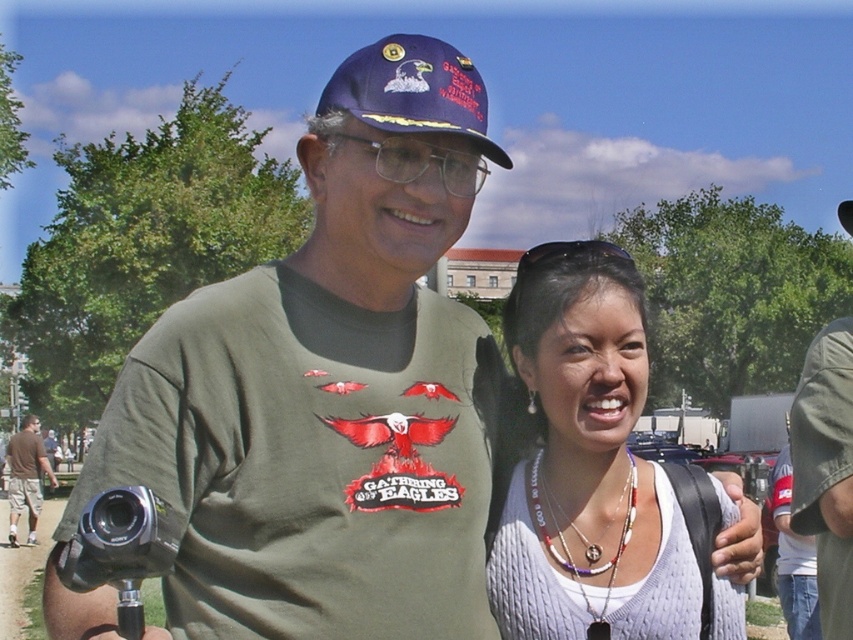
Question: Which object is the farthest from the blue fabric baseball cap at upper center?

Choices:
 (A) white knitted sweater at center
 (B) brown cotton shorts at lower left

Answer: (B)

Question: Which object appears farthest from the camera in this image?

Choices:
 (A) transparent plastic goggles at upper center
 (B) blue fabric baseball cap at upper center
 (C) white knitted sweater at center

Answer: (A)

Question: Can you confirm if white knitted sweater at center is positioned below silver metallic video camera at lower left?

Choices:
 (A) yes
 (B) no

Answer: (B)

Question: Which object is positioned farthest from the brown cotton shorts at lower left?

Choices:
 (A) blue fabric baseball cap at upper center
 (B) silver metallic video camera at lower left
 (C) transparent plastic goggles at upper center

Answer: (A)

Question: Can you confirm if white knitted sweater at center is bigger than brown cotton shorts at lower left?

Choices:
 (A) no
 (B) yes

Answer: (A)

Question: Does white knitted sweater at center have a lesser width compared to transparent plastic goggles at upper center?

Choices:
 (A) yes
 (B) no

Answer: (A)